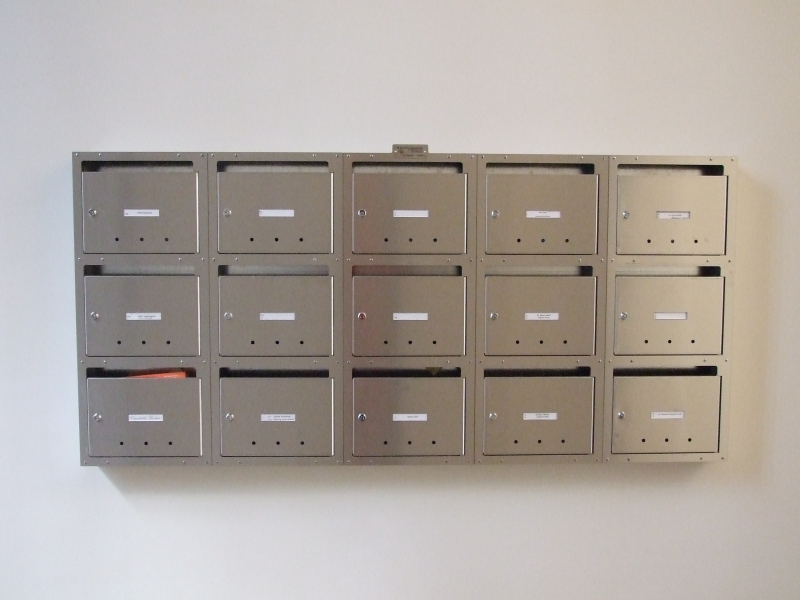
The image size is (800, 600). Identify the location of wall mailboxes are mounted upon. (126, 89).